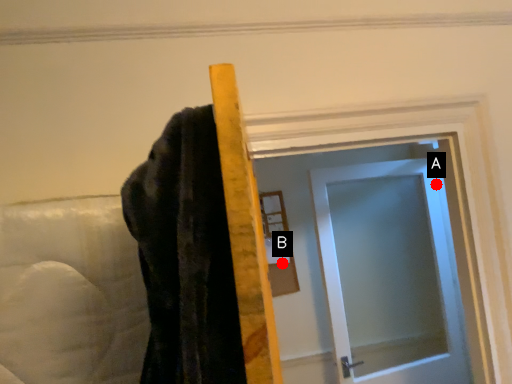
Question: Two points are circled on the image, labeled by A and B beside each circle. Which point appears farthest from the camera in this image?

Choices:
 (A) A is further
 (B) B is further

Answer: (A)